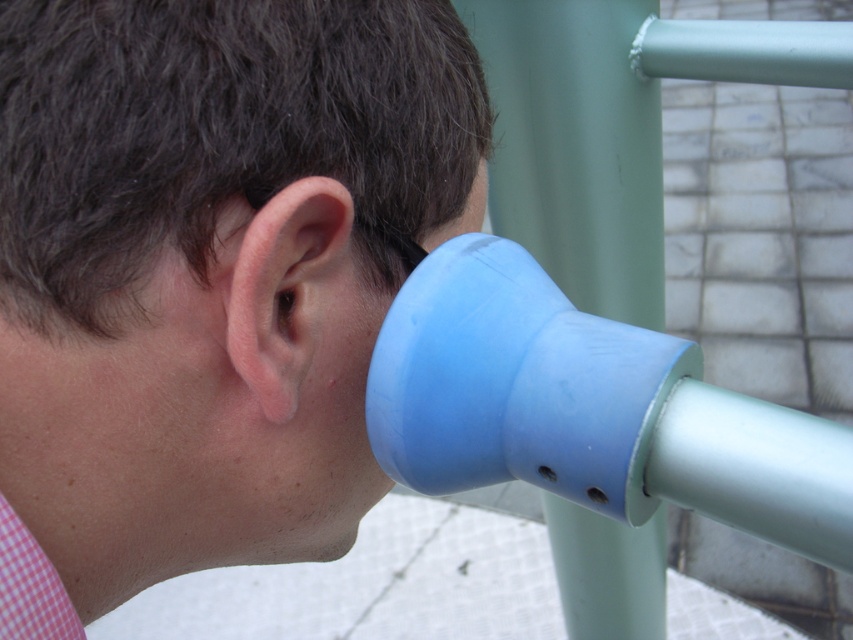
From the picture: Is blue rubber cup at right wider than pink flesh/soft tissue ear at center?

Correct, the width of blue rubber cup at right exceeds that of pink flesh/soft tissue ear at center.

Can you confirm if blue rubber cup at right is bigger than pink flesh/soft tissue ear at center?

Correct, blue rubber cup at right is larger in size than pink flesh/soft tissue ear at center.

In order to click on blue rubber cup at right in this screenshot , I will do `click(212, 269)`.

Where is `blue rubber cup at right`? This screenshot has width=853, height=640. blue rubber cup at right is located at coordinates (212, 269).